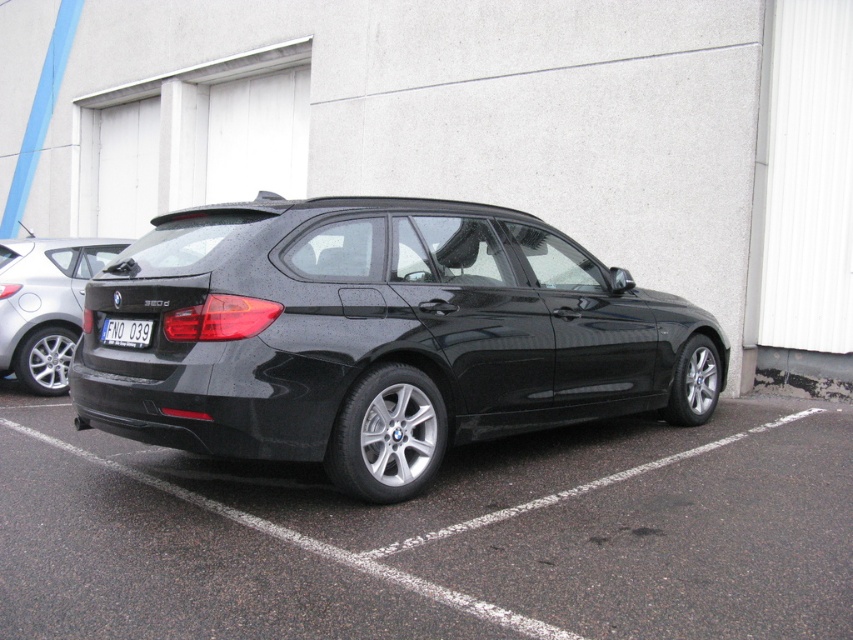
Describe the element at coordinates (378, 337) in the screenshot. I see `glossy black car at center` at that location.

Can you confirm if glossy black car at center is taller than black plastic license plate at center?

Yes.

What are the coordinates of `glossy black car at center` in the screenshot? It's located at (378, 337).

Can you confirm if black rubber parking lot at lower right is thinner than black plastic license plate at center?

No, black rubber parking lot at lower right is not thinner than black plastic license plate at center.

Consider the image. Which is more to the right, black rubber parking lot at lower right or black plastic license plate at center?

From the viewer's perspective, black rubber parking lot at lower right appears more on the right side.

This screenshot has height=640, width=853. Describe the element at coordinates (437, 534) in the screenshot. I see `black rubber parking lot at lower right` at that location.

Identify the location of black rubber parking lot at lower right. (437, 534).

From the picture: Between black rubber parking lot at lower right and glossy black car at center, which one appears on the left side from the viewer's perspective?

From the viewer's perspective, black rubber parking lot at lower right appears more on the left side.

Locate an element on the screen. This screenshot has width=853, height=640. black rubber parking lot at lower right is located at coordinates (x=437, y=534).

Does point (10, 605) come behind point (485, 394)?

No, (10, 605) is in front of (485, 394).

Image resolution: width=853 pixels, height=640 pixels. I want to click on black rubber parking lot at lower right, so click(x=437, y=534).